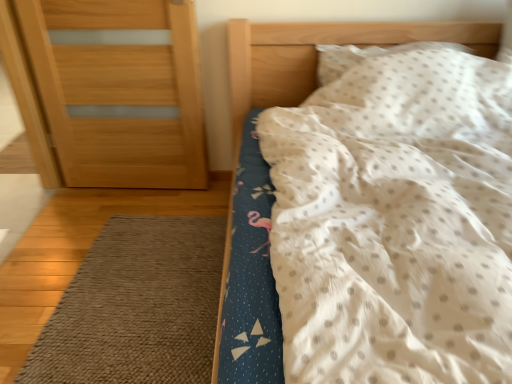
Where is `white dotted pillow at upper right`? white dotted pillow at upper right is located at coordinates pyautogui.click(x=366, y=56).

This screenshot has height=384, width=512. What do you see at coordinates (119, 92) in the screenshot? I see `wooden door at left` at bounding box center [119, 92].

The height and width of the screenshot is (384, 512). What are the coordinates of `white dotted pillow at upper right` in the screenshot? It's located at (366, 56).

Is brown textured rug at lower left turned away from white dotted pillow at upper right?

Result: No.

From a real-world perspective, is brown textured rug at lower left physically above white dotted pillow at upper right?

Actually, brown textured rug at lower left is physically below white dotted pillow at upper right in the real world.

Between brown textured rug at lower left and white dotted pillow at upper right, which one has smaller size?

Smaller between the two is brown textured rug at lower left.

Is brown textured rug at lower left with white dotted pillow at upper right?

No.

Is brown textured rug at lower left located within wooden door at left?

No, brown textured rug at lower left is located outside of wooden door at left.

In the image, there is a wooden door at left. At what (x,y) coordinates should I click in order to perform the action: click on doormat below it (from a real-world perspective). Please return your answer as a coordinate pair (x, y). Looking at the image, I should click on (137, 307).

Which object is positioned more to the right, wooden door at left or brown textured rug at lower left?

From the viewer's perspective, brown textured rug at lower left appears more on the right side.

Could you tell me if wooden door at left is facing white dotted fabric at upper right?

No, wooden door at left is not oriented towards white dotted fabric at upper right.

Does wooden door at left have a smaller size compared to white dotted fabric at upper right?

Correct, wooden door at left occupies less space than white dotted fabric at upper right.

Is wooden door at left inside or outside of white dotted fabric at upper right?

wooden door at left is spatially situated outside white dotted fabric at upper right.

From a real-world perspective, is wooden door at left positioned under white dotted pillow at upper right based on gravity?

Yes.

Is wooden door at left inside or outside of white dotted pillow at upper right?

wooden door at left is not enclosed by white dotted pillow at upper right.

Between wooden door at left and white dotted pillow at upper right, which one is positioned behind?

white dotted pillow at upper right is behind.

From the image's perspective, would you say wooden door at left is positioned over white dotted pillow at upper right?

No.

Do you think white dotted pillow at upper right is within brown textured rug at lower left, or outside of it?

white dotted pillow at upper right is outside brown textured rug at lower left.

Is the surface of white dotted pillow at upper right in direct contact with brown textured rug at lower left?

A: No, white dotted pillow at upper right is not touching brown textured rug at lower left.

From the image's perspective, is white dotted pillow at upper right located above or below brown textured rug at lower left?

white dotted pillow at upper right is situated higher than brown textured rug at lower left in the image.

In the image, there is a brown textured rug at lower left. Where is `bed above it (from the image's perspective)`? The width and height of the screenshot is (512, 384). bed above it (from the image's perspective) is located at coordinates (316, 55).

How different are the orientations of white dotted fabric at upper right and brown textured rug at lower left in degrees?

There is a 86.6-degree angle between the facing directions of white dotted fabric at upper right and brown textured rug at lower left.

Does white dotted fabric at upper right turn towards brown textured rug at lower left?

No, white dotted fabric at upper right is not oriented towards brown textured rug at lower left.

Locate an element on the screen. The height and width of the screenshot is (384, 512). bed located below the wooden door at left (from the image's perspective) is located at coordinates (316, 55).

Is white dotted fabric at upper right not close to wooden door at left?

No, there isn't a large distance between white dotted fabric at upper right and wooden door at left.

Is white dotted fabric at upper right turned away from wooden door at left?

That's not correct — white dotted fabric at upper right is not looking away from wooden door at left.

Looking at this image, is white dotted fabric at upper right taller than wooden door at left?

Indeed, white dotted fabric at upper right has a greater height compared to wooden door at left.

This screenshot has width=512, height=384. In order to click on doormat located in front of the white dotted pillow at upper right in this screenshot , I will do `click(137, 307)`.

Locate an element on the screen. The width and height of the screenshot is (512, 384). door above the brown textured rug at lower left (from a real-world perspective) is located at coordinates (119, 92).

Looking at the image, which one is located closer to brown textured rug at lower left, white dotted pillow at upper right or wooden door at left?

wooden door at left.

Estimate the real-world distances between objects in this image. Which object is closer to brown textured rug at lower left, white dotted fabric at upper right or wooden door at left?

Based on the image, wooden door at left appears to be nearer to brown textured rug at lower left.

Based on their spatial positions, is brown textured rug at lower left or white dotted pillow at upper right further from white dotted fabric at upper right?

Among the two, brown textured rug at lower left is located further to white dotted fabric at upper right.

Estimate the real-world distances between objects in this image. Which object is further from wooden door at left, brown textured rug at lower left or white dotted fabric at upper right?

brown textured rug at lower left lies further to wooden door at left than the other object.

When comparing their distances from white dotted pillow at upper right, does white dotted fabric at upper right or wooden door at left seem closer?

white dotted fabric at upper right is positioned closer to the anchor white dotted pillow at upper right.

Which object lies further to the anchor point white dotted pillow at upper right, brown textured rug at lower left or white dotted fabric at upper right?

Based on the image, brown textured rug at lower left appears to be further to white dotted pillow at upper right.

Based on their spatial positions, is white dotted fabric at upper right or brown textured rug at lower left closer to white dotted pillow at upper right?

white dotted fabric at upper right.

When comparing their distances from white dotted fabric at upper right, does white dotted pillow at upper right or wooden door at left seem closer?

white dotted pillow at upper right is positioned closer to the anchor white dotted fabric at upper right.

Identify the location of doormat between white dotted fabric at upper right and white dotted pillow at upper right from front to back. (137, 307).

Locate an element on the screen. The image size is (512, 384). doormat between wooden door at left and white dotted fabric at upper right in the horizontal direction is located at coordinates (137, 307).

Locate an element on the screen. This screenshot has width=512, height=384. doormat between wooden door at left and white dotted pillow at upper right in the horizontal direction is located at coordinates (137, 307).

The image size is (512, 384). What are the coordinates of `door between white dotted fabric at upper right and white dotted pillow at upper right from front to back` in the screenshot? It's located at (119, 92).